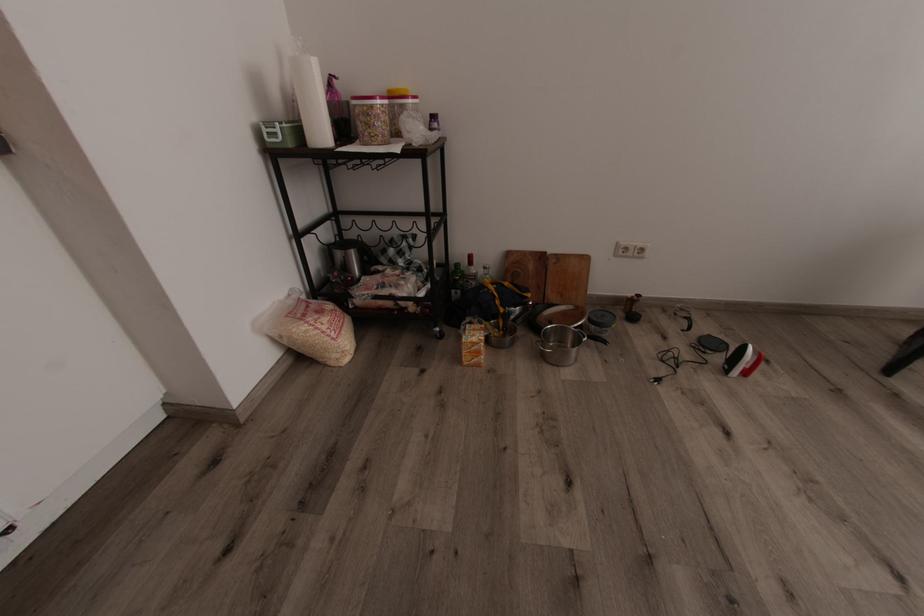
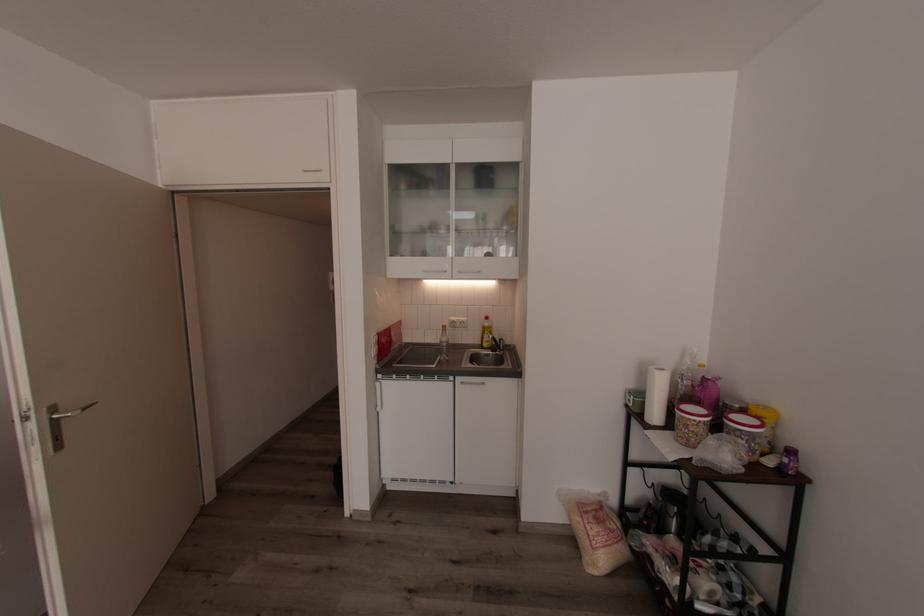
Find the pixel in the second image that matches (x=329, y=328) in the first image.

(594, 533)